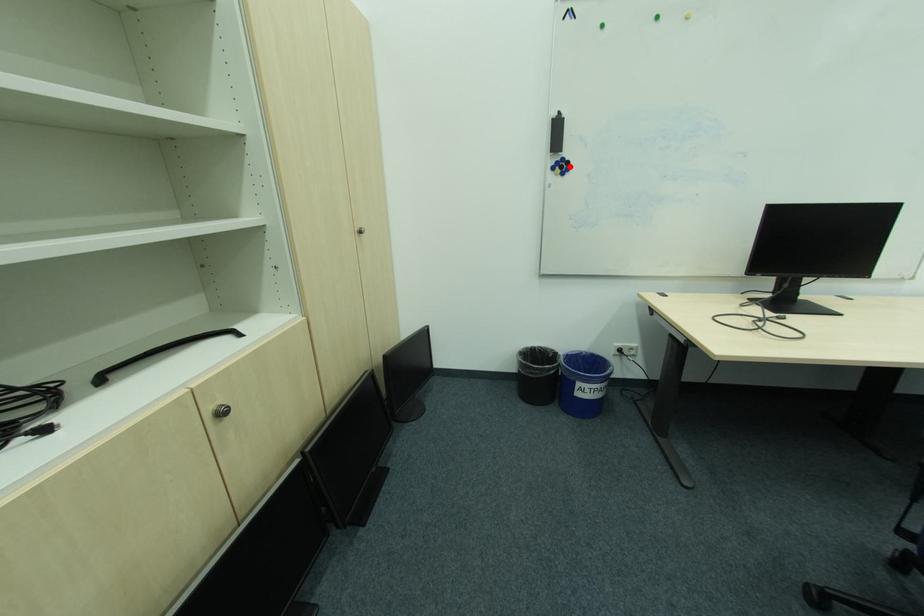
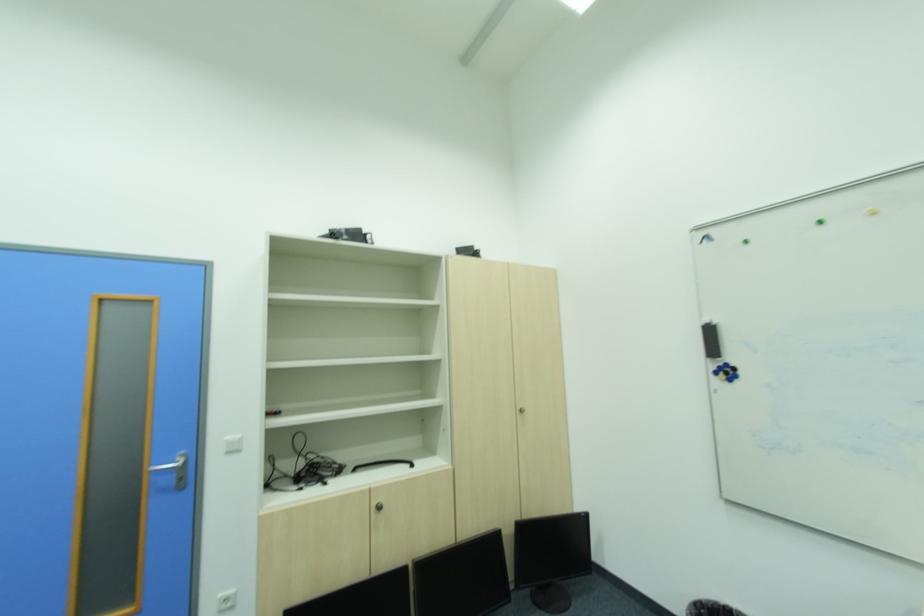
Find the pixel in the second image that matches the highlighted location in the first image.

(736, 371)